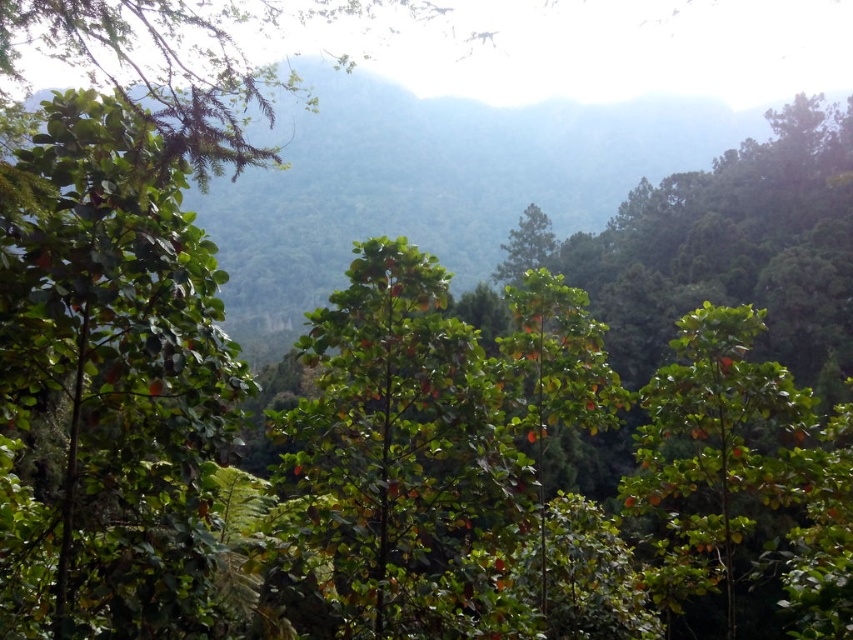
What do you see at coordinates (109, 387) in the screenshot?
I see `green matte tree at left` at bounding box center [109, 387].

Does point (68, 563) come closer to viewer compared to point (749, 513)?

Yes.

Image resolution: width=853 pixels, height=640 pixels. I want to click on green matte tree at left, so click(109, 387).